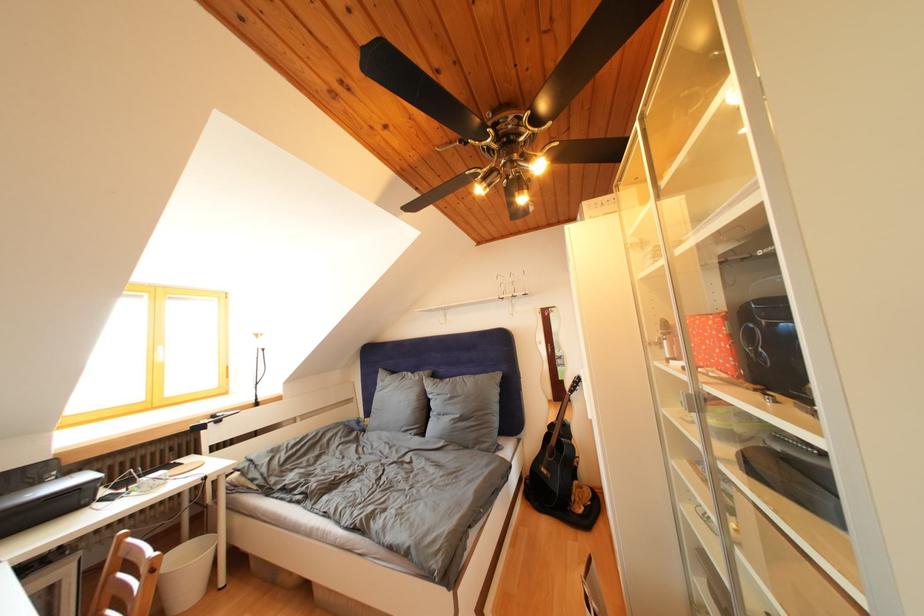
Find the location of a particular element. This screenshot has height=616, width=924. white trash can is located at coordinates (186, 573).